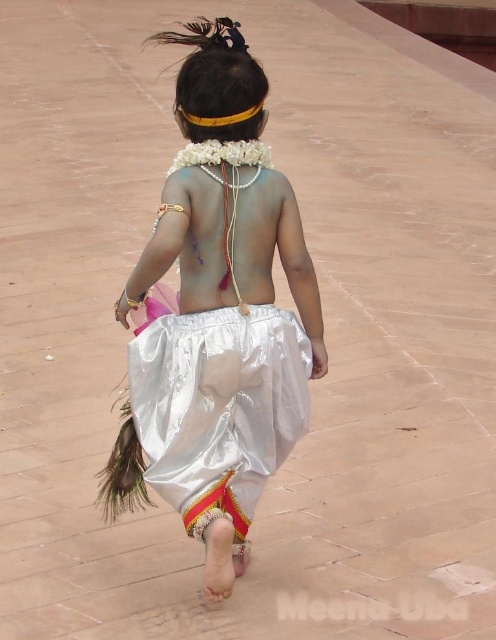
Question: Can you confirm if shiny silver skirt at center is positioned to the right of shiny white skirt at center?

Choices:
 (A) yes
 (B) no

Answer: (B)

Question: Observing the image, what is the correct spatial positioning of shiny silver skirt at center in reference to shiny white skirt at center?

Choices:
 (A) right
 (B) left

Answer: (B)

Question: Is shiny silver skirt at center to the left of shiny white skirt at center from the viewer's perspective?

Choices:
 (A) yes
 (B) no

Answer: (A)

Question: Which point appears closest to the camera in this image?

Choices:
 (A) (246, 346)
 (B) (225, 419)

Answer: (A)

Question: Which point is farther to the camera?

Choices:
 (A) shiny silver skirt at center
 (B) shiny white skirt at center

Answer: (B)